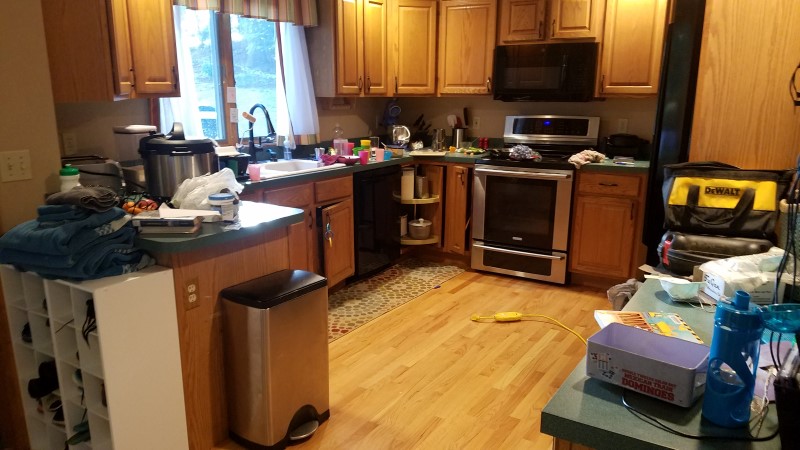
The image size is (800, 450). What are the coordinates of `open door` in the screenshot? It's located at (321, 230).